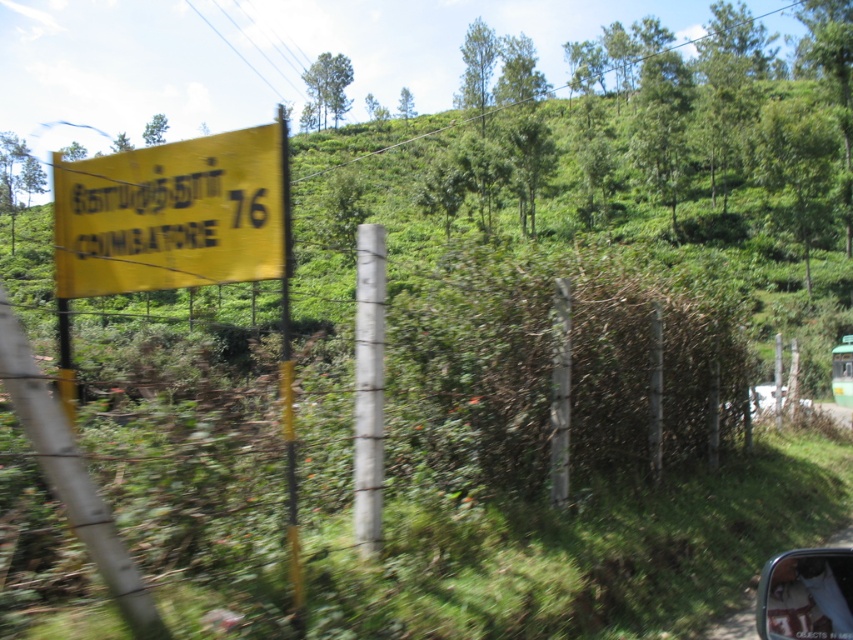
Can you confirm if yellow matte sign at left is shorter than green matte car at right?

Indeed, yellow matte sign at left has a lesser height compared to green matte car at right.

Which is in front, point (242, 234) or point (844, 352)?

Point (242, 234) is more forward.

At what (x,y) coordinates should I click in order to perform the action: click on yellow matte sign at left. Please return your answer as a coordinate pair (x, y). This screenshot has width=853, height=640. Looking at the image, I should click on (171, 214).

Who is shorter, yellow matte sign at left or transparent plastic car window at lower right?

transparent plastic car window at lower right

Which is more to the left, yellow matte sign at left or transparent plastic car window at lower right?

yellow matte sign at left

Find the location of `yellow matte sign at left`. yellow matte sign at left is located at coordinates (171, 214).

Does transparent plastic car window at lower right have a lesser height compared to green matte car at right?

Correct, transparent plastic car window at lower right is not as tall as green matte car at right.

I want to click on transparent plastic car window at lower right, so click(x=807, y=596).

You are a GUI agent. You are given a task and a screenshot of the screen. Output one action in this format:
    pyautogui.click(x=<x>, y=<y>)
    Task: Click on the transparent plastic car window at lower right
    The image size is (853, 640).
    Given the screenshot: What is the action you would take?
    pyautogui.click(x=807, y=596)

At what (x,y) coordinates should I click in order to perform the action: click on transparent plastic car window at lower right. Please return your answer as a coordinate pair (x, y). Looking at the image, I should click on (807, 596).